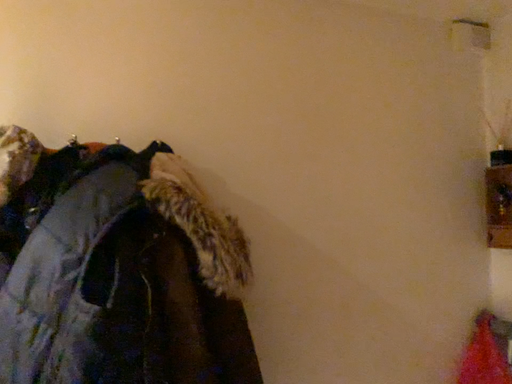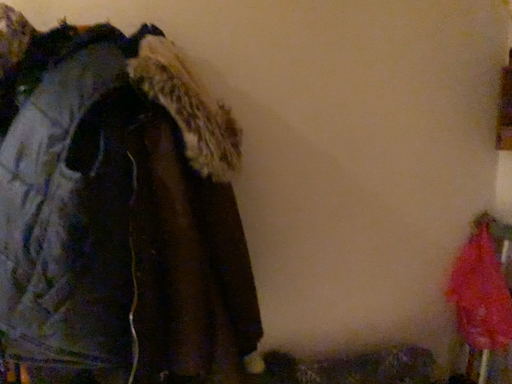
Question: Which way did the camera rotate in the video?

Choices:
 (A) rotated upward
 (B) rotated downward

Answer: (B)